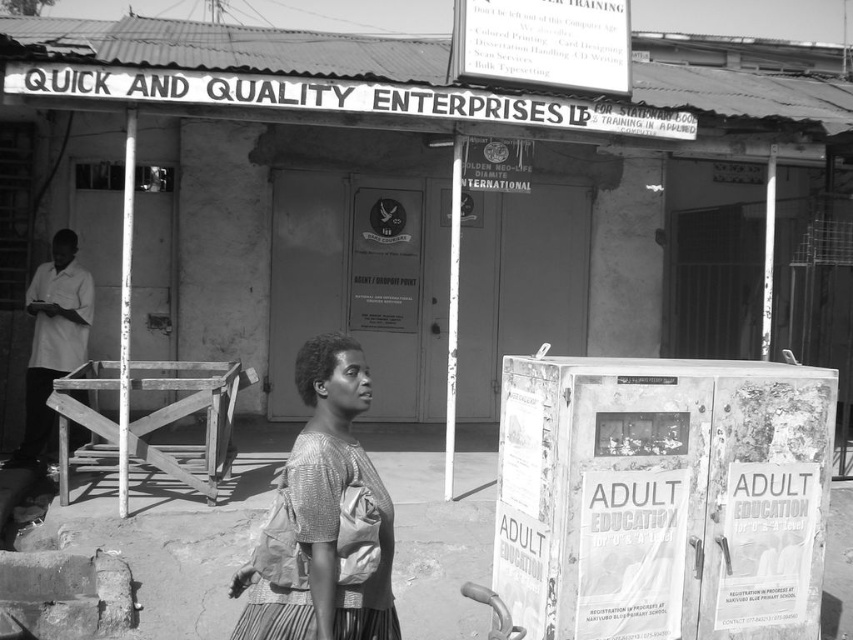
Question: Estimate the real-world distances between objects in this image. Which object is closer to the white cardboard bulletin board at lower right?

Choices:
 (A) knitted fabric dress at center
 (B) white paper sign at upper center
 (C) white shirt at left

Answer: (A)

Question: Is knitted fabric dress at center closer to camera compared to white shirt at left?

Choices:
 (A) no
 (B) yes

Answer: (B)

Question: Is white cardboard bulletin board at lower right below knitted fabric dress at center?

Choices:
 (A) no
 (B) yes

Answer: (B)

Question: Which point is farther from the camera taking this photo?

Choices:
 (A) (254, 570)
 (B) (619, 93)
 (C) (788, 538)
 (D) (59, 260)

Answer: (D)

Question: Which of the following is the closest to the observer?

Choices:
 (A) white paper sign at upper center
 (B) white cardboard bulletin board at lower right
 (C) white shirt at left

Answer: (B)

Question: Can you confirm if white paper sign at upper center is positioned below white shirt at left?

Choices:
 (A) no
 (B) yes

Answer: (A)